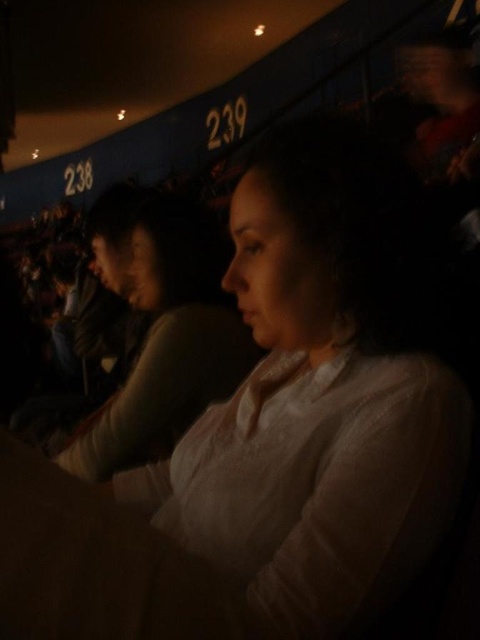
You are a photographer trying to capture a candid shot of two people wearing shirts at center. The white matte shirt at center and the light pink fabric shirt at center. Which shirt is positioned lower in the frame?

The white matte shirt at center is below the light pink fabric shirt at center, so the white matte shirt at center is positioned lower in the frame.

You are a photographer standing in the dimly lit indoor setting. You want to take a closeup shot of the white matte shirt at center without moving the subject. Considering your current position, is the distance sufficient for a clear closeup without needing to adjust your position?

The white matte shirt at center is 14.73 inches away from viewer. This distance is sufficient for a clear closeup shot without needing to adjust your position.

You are a photographer trying to capture both the white matte shirt at center and the light pink fabric shirt at center in a single shot. Given that your camera has a minimum focus distance of 50 centimeters, will you be able to focus on both shirts simultaneously?

The white matte shirt at center and the light pink fabric shirt at center are 56.47 centimeters apart from each other. Since the distance between them is greater than the camera minimum focus distance of 50 centimeters, the camera can focus on both shirts simultaneously.